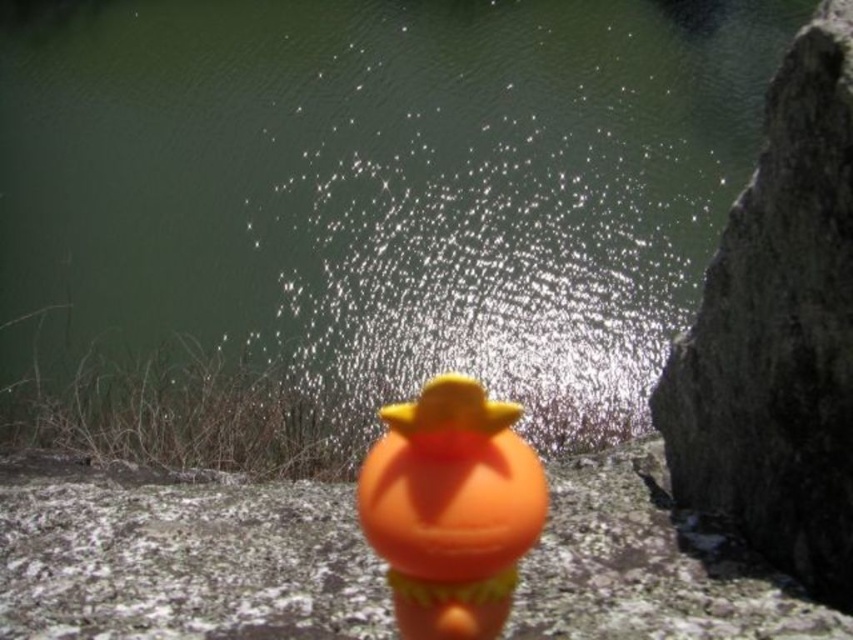
Question: Among these objects, which one is nearest to the camera?

Choices:
 (A) gray rough rock at right
 (B) green matte water at center
 (C) orange matte rubber duck at center

Answer: (C)

Question: Which point is closer to the camera taking this photo?

Choices:
 (A) (111, 385)
 (B) (833, 173)
 (C) (473, 461)

Answer: (C)

Question: Is green matte water at center below orange matte rubber duck at center?

Choices:
 (A) no
 (B) yes

Answer: (A)

Question: Among these points, which one is nearest to the camera?

Choices:
 (A) (809, 536)
 (B) (453, 509)
 (C) (543, 61)

Answer: (B)

Question: Considering the relative positions of gray rough rock at right and orange matte rubber duck at center in the image provided, where is gray rough rock at right located with respect to orange matte rubber duck at center?

Choices:
 (A) left
 (B) right

Answer: (B)

Question: Does green matte water at center have a lesser width compared to orange matte rubber duck at center?

Choices:
 (A) yes
 (B) no

Answer: (B)